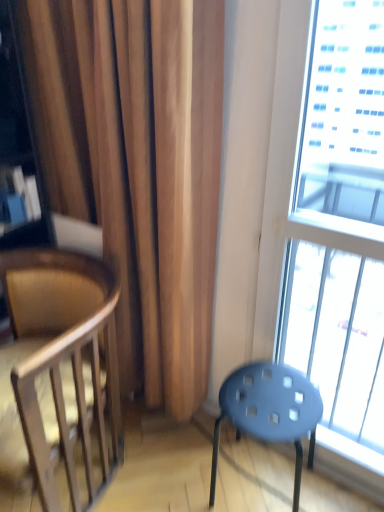
Question: From a real-world perspective, relative to transparent glass window at right, is wooden chair at left vertically above or below?

Choices:
 (A) below
 (B) above

Answer: (A)

Question: In terms of height, does wooden chair at left look taller or shorter compared to transparent glass window at right?

Choices:
 (A) tall
 (B) short

Answer: (B)

Question: Which is farther from the wooden chair at left?

Choices:
 (A) matte blue stool at lower right
 (B) transparent glass window at right

Answer: (B)

Question: Based on their relative distances, which object is nearer to the transparent glass window at right?

Choices:
 (A) wooden chair at left
 (B) matte blue stool at lower right

Answer: (B)